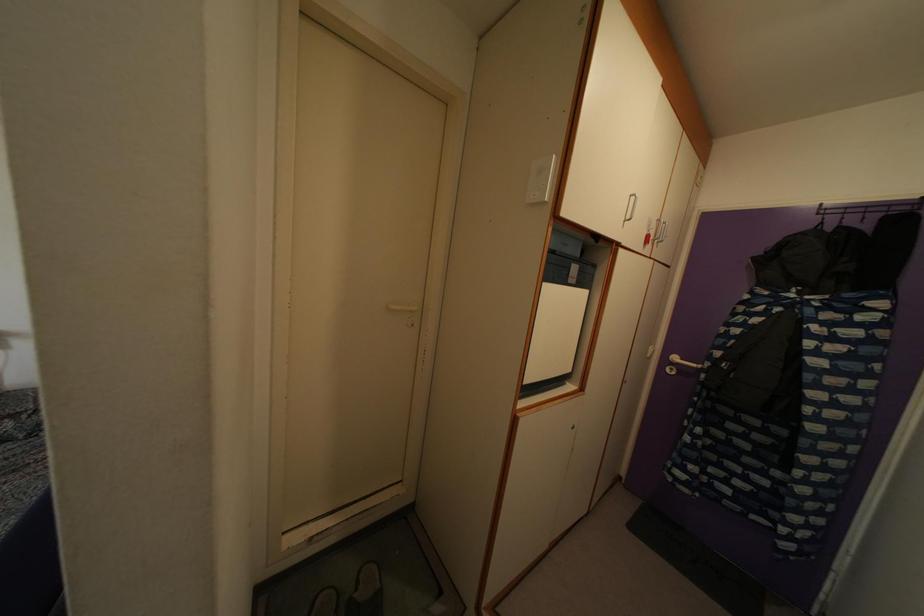
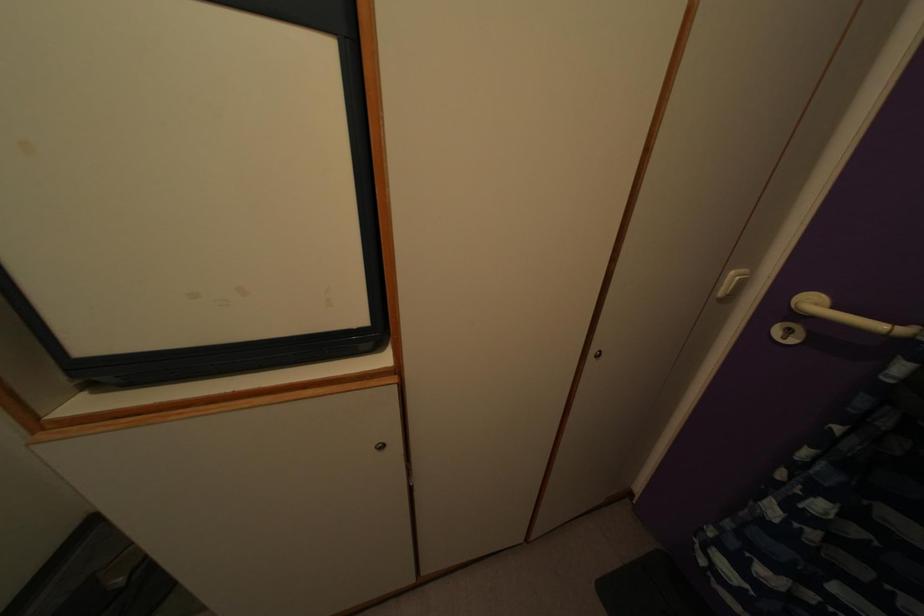
Where in the second image is the point corresponding to (x=677, y=367) from the first image?

(815, 310)